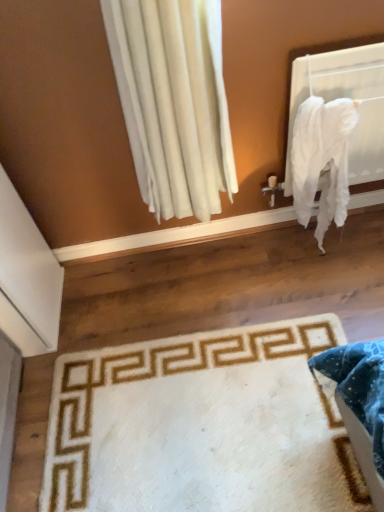
Measure the distance between point (362, 58) and camera.

Point (362, 58) is 1.22 meters away from camera.

Image resolution: width=384 pixels, height=512 pixels. Identify the location of white cotton blanket at right. (322, 160).

Which point is more forward, [294,151] or [45,503]?

The point [45,503] is more forward.

How different are the orientations of white cotton blanket at right and white plush rug at lower center in degrees?

white cotton blanket at right and white plush rug at lower center are facing 91.5 degrees away from each other.

Can you confirm if white cotton blanket at right is wider than white plush rug at lower center?

No.

Which object is positioned more to the left, white cotton blanket at right or white plush rug at lower center?

white plush rug at lower center is more to the left.

Is white fabric at upper right next to white cotton blanket at right and touching it?

No, white fabric at upper right is not touching white cotton blanket at right.

Is white fabric at upper right completely or partially outside of white cotton blanket at right?

white fabric at upper right is positioned outside white cotton blanket at right.

Identify the location of blanket below the white fabric at upper right (from the image's perspective). The height and width of the screenshot is (512, 384). (322, 160).

Is white fabric at upper right wider or thinner than white cotton blanket at right?

white fabric at upper right is thinner than white cotton blanket at right.

Between point (286, 183) and point (50, 502), which one is positioned behind?

Positioned behind is point (286, 183).

Considering the relative sizes of white fabric at upper right and white plush rug at lower center in the image provided, is white fabric at upper right thinner than white plush rug at lower center?

Yes.

Considering the sizes of white fabric at upper right and white plush rug at lower center in the image, is white fabric at upper right taller or shorter than white plush rug at lower center?

white fabric at upper right is taller than white plush rug at lower center.

Considering the sizes of white plush rug at lower center and white cotton blanket at right in the image, is white plush rug at lower center taller or shorter than white cotton blanket at right?

In the image, white plush rug at lower center appears to be shorter than white cotton blanket at right.

From the image's perspective, does white plush rug at lower center appear lower than white cotton blanket at right?

Correct, white plush rug at lower center appears lower than white cotton blanket at right in the image.

Is white plush rug at lower center closer to the viewer compared to white cotton blanket at right?

That is True.

Considering the sizes of objects white plush rug at lower center and white cotton blanket at right in the image provided, who is wider, white plush rug at lower center or white cotton blanket at right?

white plush rug at lower center is wider.

Is white cotton blanket at right taller or shorter than white fabric at upper right?

Clearly, white cotton blanket at right is taller compared to white fabric at upper right.

In terms of size, does white cotton blanket at right appear bigger or smaller than white fabric at upper right?

Considering their sizes, white cotton blanket at right takes up more space than white fabric at upper right.

Which is more to the left, white cotton blanket at right or white fabric at upper right?

white cotton blanket at right.

Which is correct: white cotton blanket at right is inside white fabric at upper right, or outside of it?

white cotton blanket at right exists outside the volume of white fabric at upper right.

From a real-world perspective, is white plush rug at lower center over white fabric at upper right?

No, from a real-world perspective, white plush rug at lower center is not on top of white fabric at upper right.

Which object is further away from the camera, white plush rug at lower center or white fabric at upper right?

white fabric at upper right is behind.

Measure the distance between white plush rug at lower center and white fabric at upper right.

A distance of 34.94 inches exists between white plush rug at lower center and white fabric at upper right.

In terms of width, does white plush rug at lower center look wider or thinner when compared to white fabric at upper right?

In the image, white plush rug at lower center appears to be wider than white fabric at upper right.

Where is `mat located below the white cotton blanket at right (from the image's perspective)`? This screenshot has height=512, width=384. mat located below the white cotton blanket at right (from the image's perspective) is located at coordinates (201, 425).

Find the location of a particular element. The height and width of the screenshot is (512, 384). blanket lying in front of the white fabric at upper right is located at coordinates (322, 160).

Considering their positions, is white cotton blanket at right positioned closer to white fabric at upper right than white plush rug at lower center?

white cotton blanket at right is positioned closer to the anchor white fabric at upper right.

Estimate the real-world distances between objects in this image. Which object is further from white plush rug at lower center, white fabric at upper right or white cotton blanket at right?

white fabric at upper right lies further to white plush rug at lower center than the other object.

Based on their spatial positions, is white plush rug at lower center or white fabric at upper right further from white cotton blanket at right?

white plush rug at lower center is further to white cotton blanket at right.

Considering their positions, is white cotton blanket at right positioned further to white plush rug at lower center than white fabric at upper right?

white fabric at upper right lies further to white plush rug at lower center than the other object.

Considering their positions, is white fabric at upper right positioned further to white cotton blanket at right than white plush rug at lower center?

white plush rug at lower center is further to white cotton blanket at right.

Estimate the real-world distances between objects in this image. Which object is further from white fabric at upper right, white plush rug at lower center or white cotton blanket at right?

white plush rug at lower center is positioned further to the anchor white fabric at upper right.

Find the location of a particular element. The width and height of the screenshot is (384, 512). blanket that lies between white fabric at upper right and white plush rug at lower center from top to bottom is located at coordinates (322, 160).